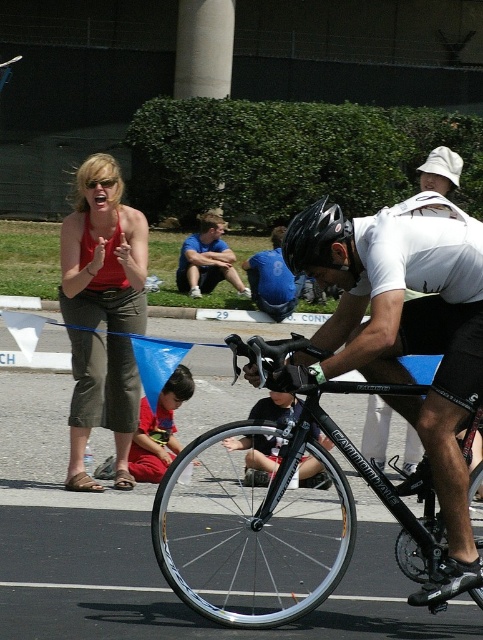
Question: Does blue shirt at center appear over blue jersey at center?

Choices:
 (A) yes
 (B) no

Answer: (A)

Question: Does black matte bicycle at center have a greater width compared to shiny black bike at center?

Choices:
 (A) no
 (B) yes

Answer: (A)

Question: Among these objects, which one is nearest to the camera?

Choices:
 (A) black matte bicycle at center
 (B) matte red tank top at left

Answer: (A)

Question: Can you confirm if shiny black bike at center is positioned to the right of blue shirt at center?

Choices:
 (A) no
 (B) yes

Answer: (B)

Question: Among these objects, which one is farthest from the camera?

Choices:
 (A) matte red tank top at left
 (B) blue jersey at center
 (C) blue shirt at center

Answer: (C)

Question: Which of the following is the closest to the observer?

Choices:
 (A) (94, 234)
 (B) (284, 248)
 (C) (428, 509)

Answer: (B)